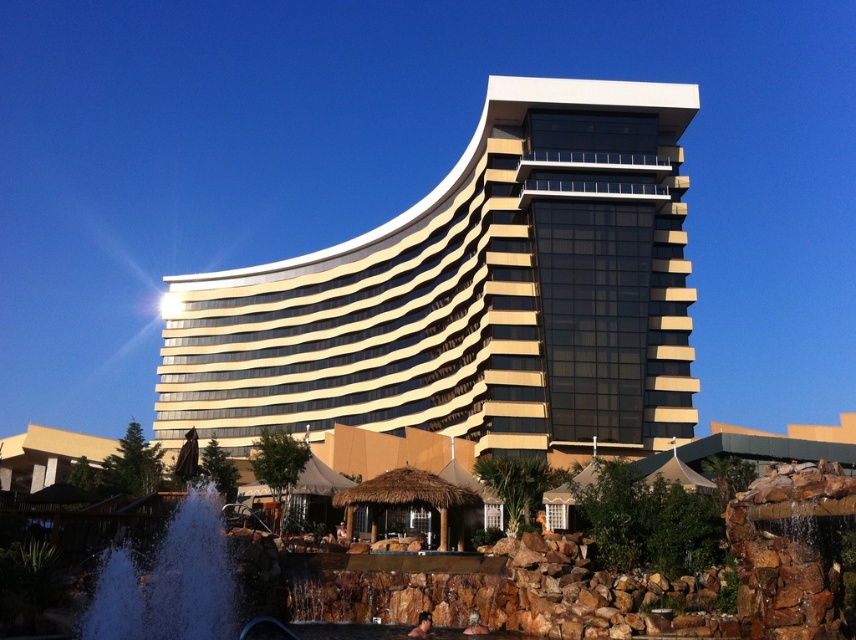
You are a photographer planning to capture the gold glass building at center and the white frothy water at lower left in a single shot. Given that the camera can only focus on one object clearly, which object should you prioritize to ensure it fills more of the frame?

The gold glass building at center is larger in size than the white frothy water at lower left, so you should prioritize focusing on the gold glass building at center to ensure it fills more of the frame.

You are standing at the entrance of the resort and want to take a photo of the gold glass building at center. To ensure the building is centered in your frame, where should you position yourself relative to the fountain and waterfall?

The gold glass building at center is located at point (471, 300), so you should position yourself slightly to the right and above the fountain and waterfall to center it in your frame.

You are a photographer planning to capture the gold glass building at center and the white frothy water at lower left in a single frame. Based on their sizes, which object should you focus on to ensure both are clearly visible without cropping?

The gold glass building at center is wider than the white frothy water at lower left, so focusing on the gold glass building at center would ensure both are visible without cropping since it occupies more space in the frame.